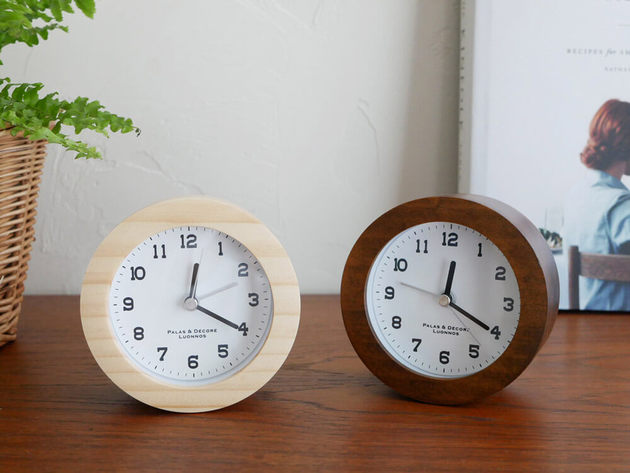
This screenshot has width=630, height=473. In order to click on wall in this screenshot , I will do `click(261, 109)`.